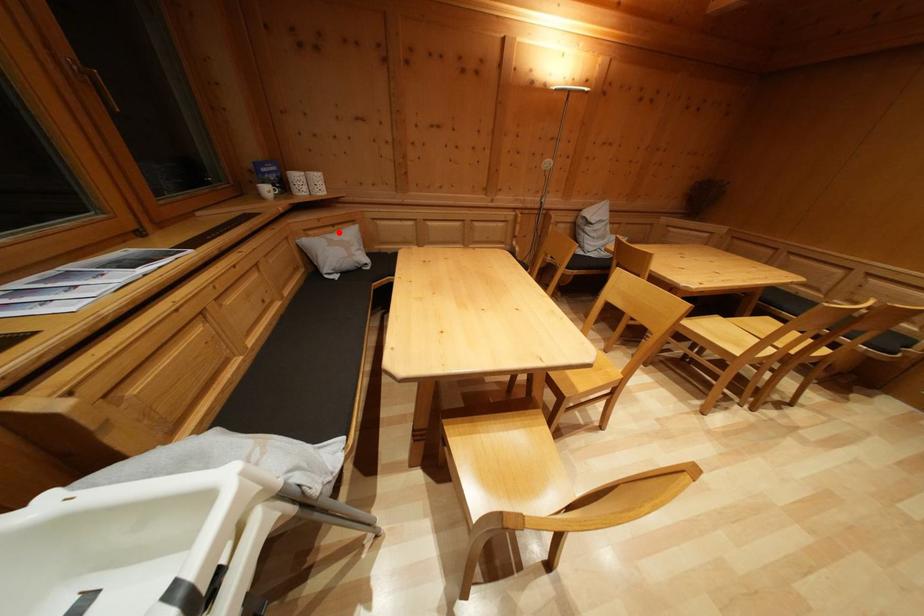
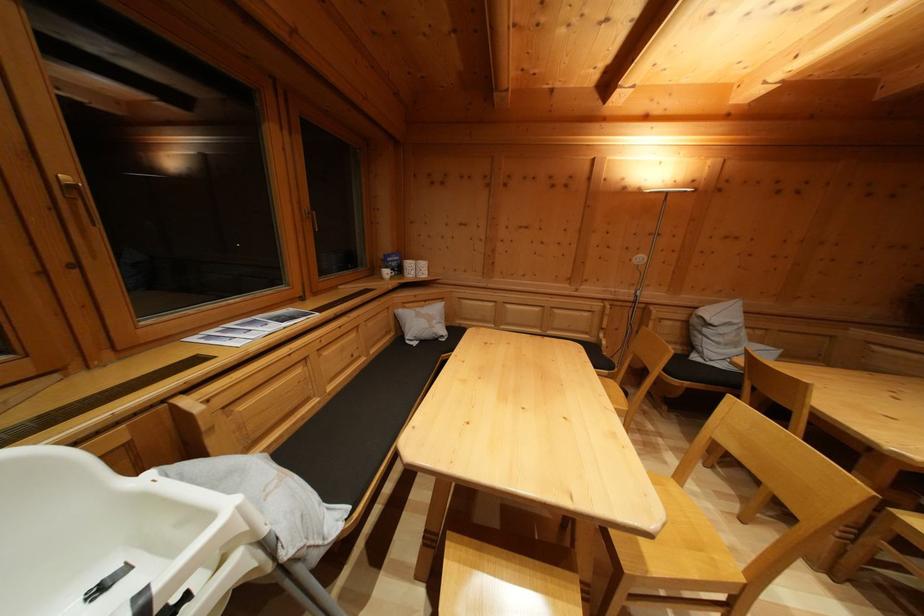
Where in the second image is the point corresponding to the highlighted location from the first image?

(431, 308)